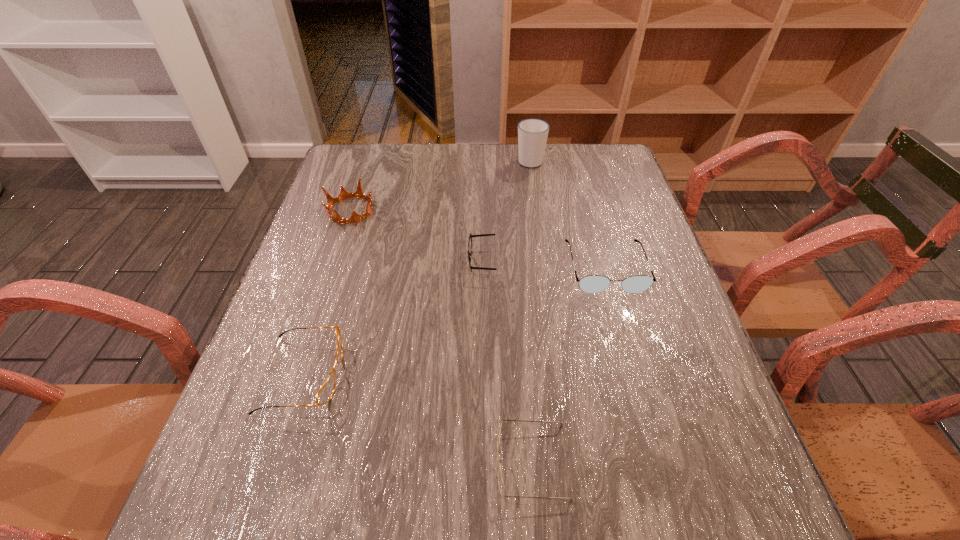
Find the location of a particular element. Image resolution: width=960 pixels, height=540 pixels. vacant area at the right edge of the desktop is located at coordinates (679, 414).

The width and height of the screenshot is (960, 540). In the image, there is a desktop. What are the coordinates of `vacant space at the far left corner` in the screenshot? It's located at pyautogui.click(x=355, y=164).

In order to click on vacant space that's between the farthest object and the second nearest object in this screenshot , I will do `click(417, 268)`.

Locate an element on the screen. This screenshot has width=960, height=540. unoccupied area between the leftmost spectacles and the rightmost object is located at coordinates (454, 321).

This screenshot has width=960, height=540. I want to click on vacant space that's between the rightmost object and the nearest spectacles, so click(568, 365).

Where is `blank region between the leftmost spectacles and the farthest object`? blank region between the leftmost spectacles and the farthest object is located at coordinates (417, 268).

Identify the location of vacant space in between the second farthest object and the rightmost spectacles. The height and width of the screenshot is (540, 960). (478, 239).

This screenshot has width=960, height=540. Find the location of `vacant point located between the second nearest spectacles and the crown`. vacant point located between the second nearest spectacles and the crown is located at coordinates (326, 292).

Locate an element on the screen. The height and width of the screenshot is (540, 960). free space that is in between the nearest object and the tallest object is located at coordinates (531, 312).

Identify the location of free space that is in between the crown and the tallest object. The height and width of the screenshot is (540, 960). (441, 185).